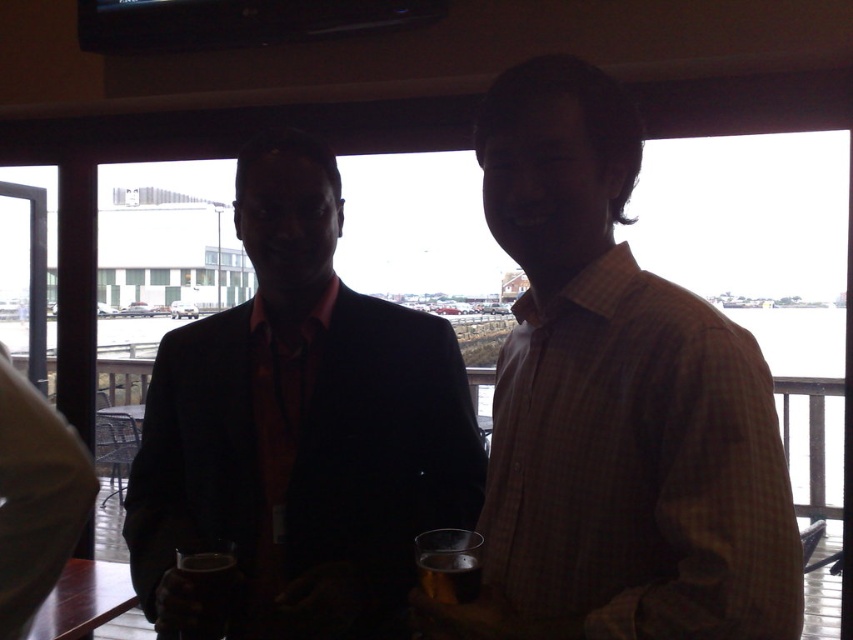
Does translucent glass mug at lower left appear under translucent glass at center?

Correct, translucent glass mug at lower left is located below translucent glass at center.

Does point (219, 612) come in front of point (479, 582)?

That is False.

I want to click on translucent glass mug at lower left, so click(x=207, y=592).

Between matte black suit at center and translucent glass at center, which one has less height?

translucent glass at center

Measure the distance between matte black suit at center and translucent glass at center.

matte black suit at center and translucent glass at center are 18.86 inches apart from each other.

Locate an element on the screen. Image resolution: width=853 pixels, height=640 pixels. matte black suit at center is located at coordinates (300, 428).

Which is more to the left, brown checkered shirt at center or translucent glass mug at lower left?

From the viewer's perspective, translucent glass mug at lower left appears more on the left side.

In order to click on brown checkered shirt at center in this screenshot , I will do `click(614, 404)`.